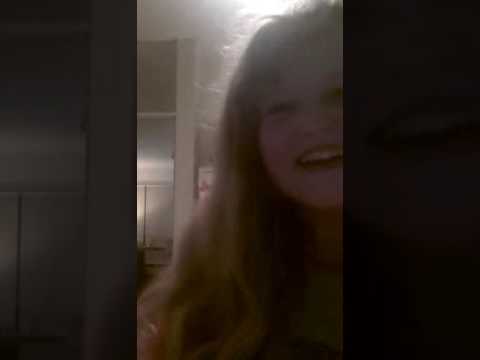
Where is `walls`? The image size is (480, 360). walls is located at coordinates (156, 22), (197, 25).